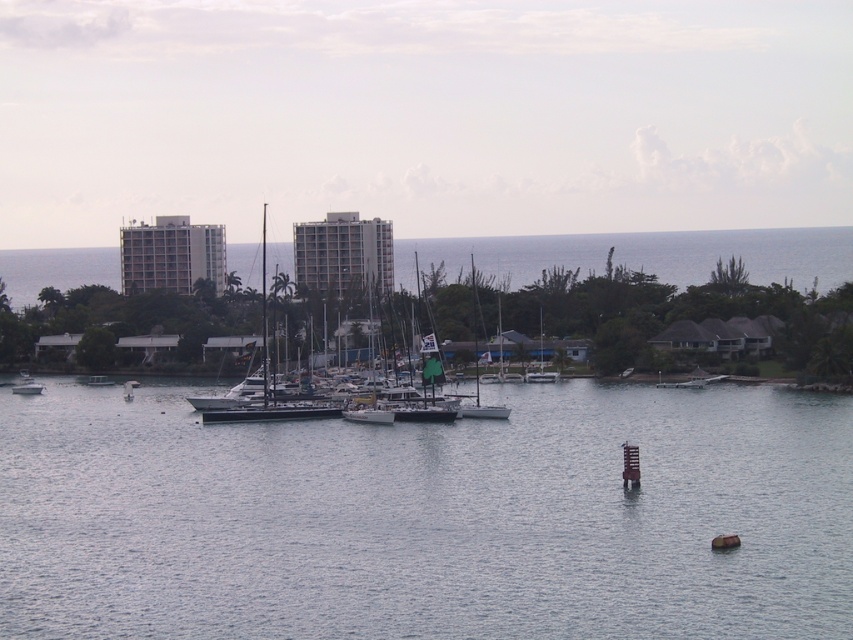
Question: Among these objects, which one is farthest from the camera?

Choices:
 (A) brown wooden buoy at lower right
 (B) dark gray metallic sailboat at center
 (C) clear water at center

Answer: (B)

Question: Which point is closer to the camera?

Choices:
 (A) (734, 547)
 (B) (234, 564)

Answer: (B)

Question: In this image, where is dark gray metallic sailboat at center located relative to brown wooden buoy at lower right?

Choices:
 (A) left
 (B) right

Answer: (A)

Question: Which point appears farthest from the camera in this image?

Choices:
 (A) (285, 406)
 (B) (349, 452)
 (C) (737, 538)

Answer: (A)

Question: Does clear water at center appear under brown wooden buoy at lower right?

Choices:
 (A) no
 (B) yes

Answer: (A)

Question: Does clear water at center come behind brown wooden buoy at lower right?

Choices:
 (A) no
 (B) yes

Answer: (A)